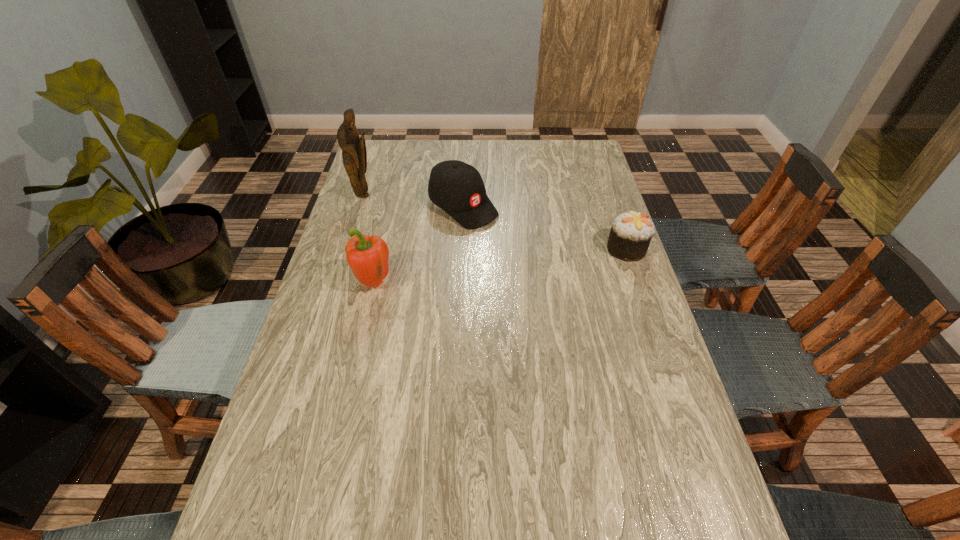
The height and width of the screenshot is (540, 960). I want to click on blank space located on the front-facing side of the leftmost object, so tap(446, 237).

You are a GUI agent. You are given a task and a screenshot of the screen. Output one action in this format:
    pyautogui.click(x=<x>, y=<y>)
    Task: Click on the free space located 0.240m on the front-facing side of the leftmost object
    Image resolution: width=960 pixels, height=540 pixels.
    Given the screenshot: What is the action you would take?
    pyautogui.click(x=425, y=226)

At what (x,y) coordinates should I click in order to perform the action: click on vacant region located with a logo on the front of the baseball cap. Please return your answer as a coordinate pair (x, y). This screenshot has height=540, width=960. Looking at the image, I should click on (567, 287).

Locate an element on the screen. vacant region located 0.090m with a logo on the front of the baseball cap is located at coordinates (504, 238).

Where is `free space located 0.200m with a logo on the front of the baseball cap`? The width and height of the screenshot is (960, 540). free space located 0.200m with a logo on the front of the baseball cap is located at coordinates (528, 256).

This screenshot has width=960, height=540. What are the coordinates of `pepper situated at the left edge` in the screenshot? It's located at (368, 257).

You are a GUI agent. You are given a task and a screenshot of the screen. Output one action in this format:
    pyautogui.click(x=<x>, y=<y>)
    Task: Click on the figurine at the left edge
    
    Given the screenshot: What is the action you would take?
    pyautogui.click(x=354, y=154)

What are the coordinates of `object present at the right edge` in the screenshot? It's located at (631, 232).

You are a GUI agent. You are given a task and a screenshot of the screen. Output one action in this format:
    pyautogui.click(x=<x>, y=<y>)
    Task: Click on the free spot at the far edge of the desktop
    The image size is (960, 540).
    Given the screenshot: What is the action you would take?
    pyautogui.click(x=548, y=170)

Identify the location of free spot at the near edge of the desktop. (523, 478).